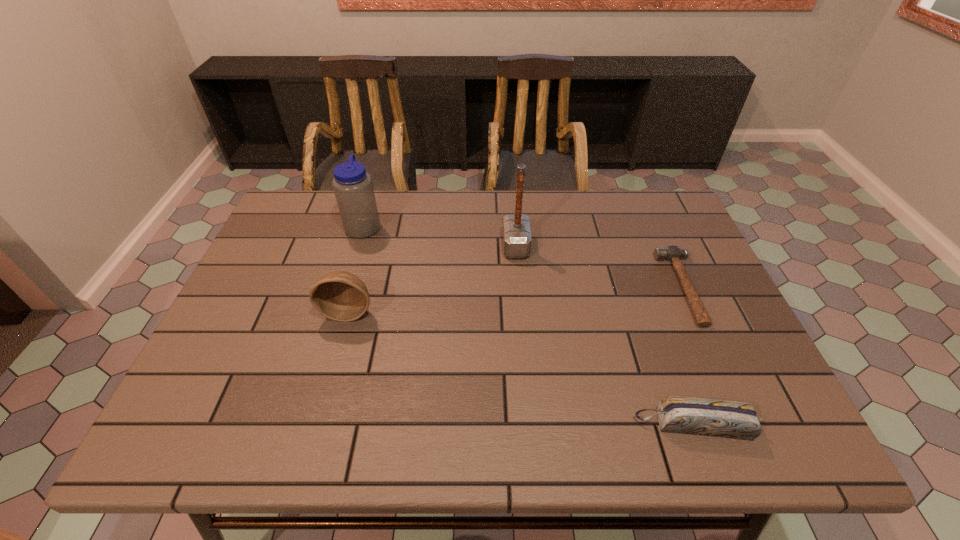
Where is `blank area located on the striking surface of the taller hammer`? The image size is (960, 540). blank area located on the striking surface of the taller hammer is located at coordinates (435, 246).

Image resolution: width=960 pixels, height=540 pixels. Identify the location of free space located with a carrying loop on the side of the fourth shortest object. (467, 226).

The width and height of the screenshot is (960, 540). In order to click on vacant space located on the front of the third shortest object in this screenshot , I will do `click(314, 436)`.

Where is `free space located 0.220m on the back of the pencil box`? The height and width of the screenshot is (540, 960). free space located 0.220m on the back of the pencil box is located at coordinates (x=658, y=326).

The height and width of the screenshot is (540, 960). Find the location of `vacant space located 0.070m on the striking face of the right hammer`. vacant space located 0.070m on the striking face of the right hammer is located at coordinates (639, 288).

Find the location of a particular element. blank space located 0.130m on the striking face of the right hammer is located at coordinates (617, 288).

Locate an element on the screen. The height and width of the screenshot is (540, 960). free space located 0.230m on the striking face of the right hammer is located at coordinates (579, 288).

Where is `hammer located at the far edge`? The height and width of the screenshot is (540, 960). hammer located at the far edge is located at coordinates (517, 239).

In order to click on water bottle at the far edge in this screenshot , I will do (352, 185).

Identify the location of object at the near edge. Image resolution: width=960 pixels, height=540 pixels. (730, 419).